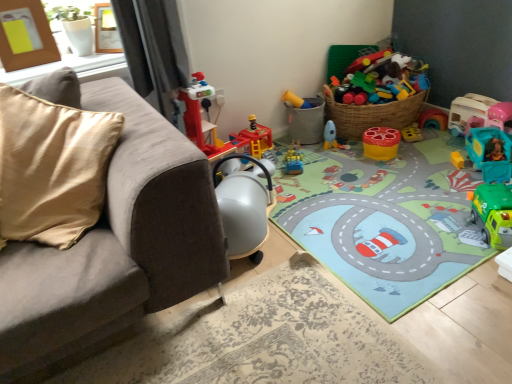
You are a GUI agent. You are given a task and a screenshot of the screen. Output one action in this format:
    pyautogui.click(x=<x>, y=<y>)
    Task: Click on the free spot to the right of shiny yellow plastic train at center, which appears as the first toy when viewed from the left
    The image size is (512, 384).
    Given the screenshot: What is the action you would take?
    pyautogui.click(x=328, y=160)